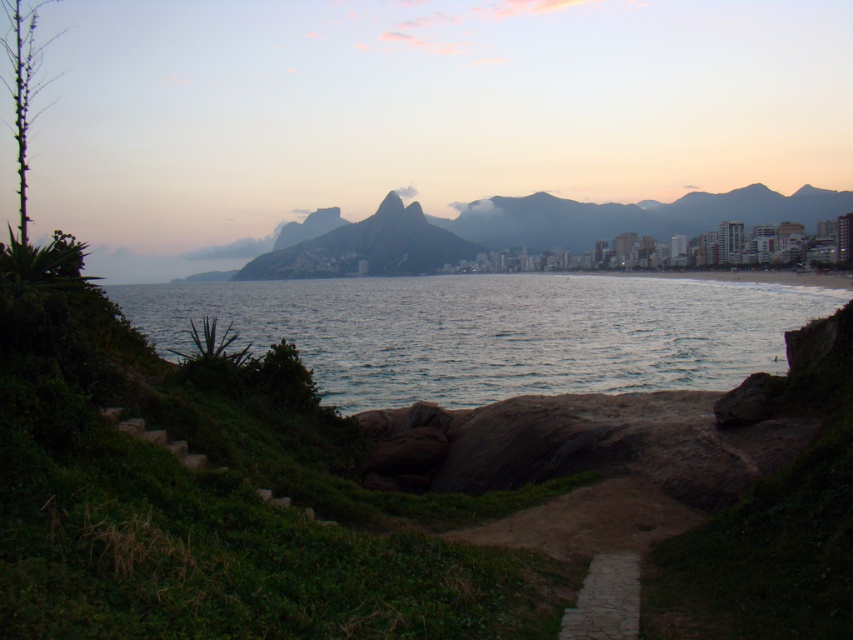
You are standing on the beach on the right side of the image and want to reach the blue water at center. Which direction should you walk to get there?

You should walk towards the center of the image to reach the blue water at center, as it is located at point coordinates of (492, 332).